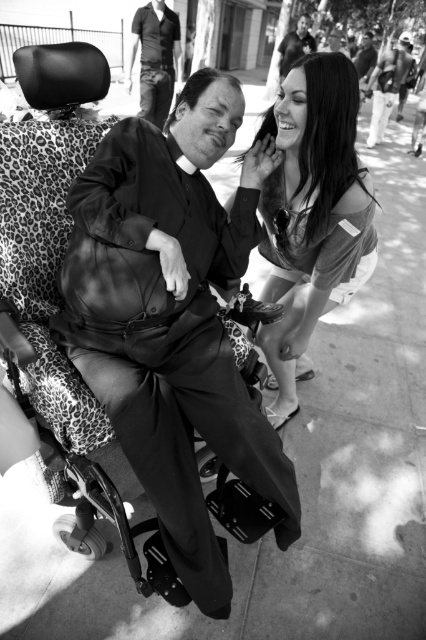
You are a photographer analyzing this black and white image. You notice the smooth fabric dress at upper right and the smooth leather jacket at upper center. Which object appears taller in the photo?

The smooth fabric dress at upper right is taller than the smooth leather jacket at upper center.

You are an observer looking at the photograph. You notice the smooth fabric dress at upper right. Where exactly is it positioned in relation to the central figure?

The smooth fabric dress at upper right is located at point 0.333 on the horizontal axis and 0.732 on the vertical axis relative to the central figure.

You are a photographer who wants to capture a closeup of the matte black suit at center. Based on the coordinates provided, where should you position your camera relative to the scene?

The matte black suit at center is located at coordinates point [172,317], so you should position your camera directly facing the center of the scene to capture it clearly.